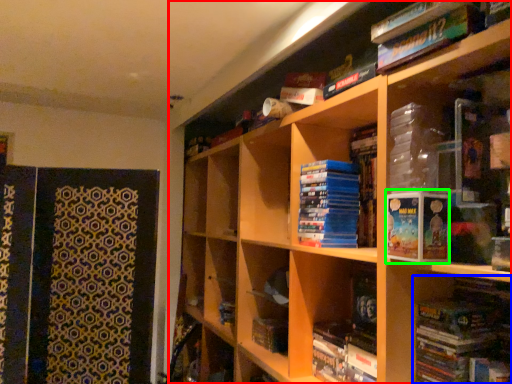
Question: Estimate the real-world distances between objects in this image. Which object is closer to bookcase (highlighted by a red box), book (highlighted by a blue box) or paperback book (highlighted by a green box)?

Choices:
 (A) book
 (B) paperback book

Answer: (A)